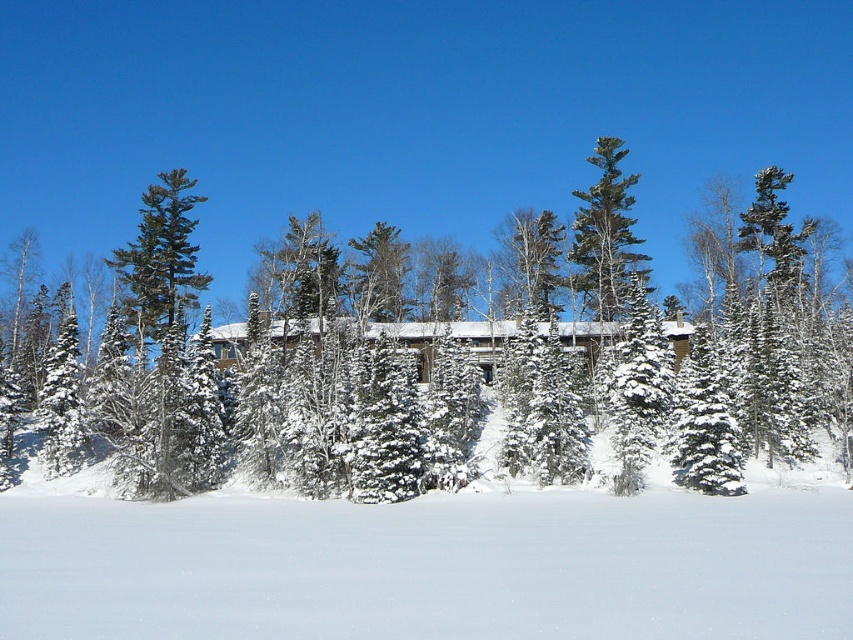
Question: Which point is farther to the camera?

Choices:
 (A) green textured pine tree at upper center
 (B) white fluffy snow at lower center

Answer: (A)

Question: Does white fluffy snow at lower center come in front of green textured pine tree at upper center?

Choices:
 (A) no
 (B) yes

Answer: (B)

Question: Which object appears closest to the camera in this image?

Choices:
 (A) green textured pine tree at upper center
 (B) white fluffy snow at lower center

Answer: (B)

Question: Is white fluffy snow at lower center wider than green textured pine tree at upper center?

Choices:
 (A) no
 (B) yes

Answer: (B)

Question: Where is white fluffy snow at lower center located in relation to green textured pine tree at upper center in the image?

Choices:
 (A) below
 (B) above

Answer: (A)

Question: Among these objects, which one is farthest from the camera?

Choices:
 (A) white fluffy snow at lower center
 (B) green textured pine tree at upper center

Answer: (B)